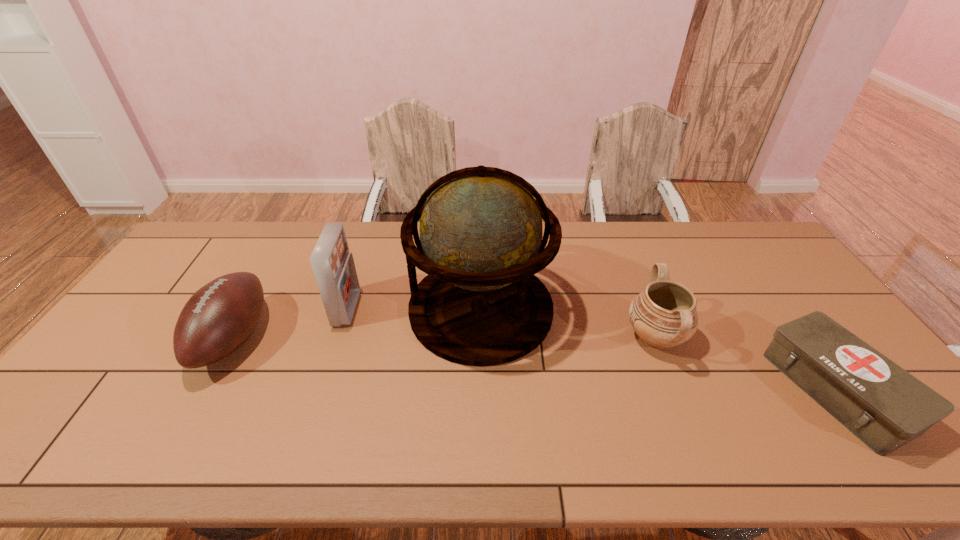
At what (x,y) coordinates should I click in order to perform the action: click on vacant area at the far edge of the desktop. Please return your answer as a coordinate pair (x, y). This screenshot has height=540, width=960. Looking at the image, I should click on coord(259,261).

The height and width of the screenshot is (540, 960). I want to click on vacant region at the left edge of the desktop, so click(137, 373).

In the image, there is a desktop. What are the coordinates of `vacant space at the far left corner` in the screenshot? It's located at (233, 233).

I want to click on free space between the shorter first-aid kit and the urn, so click(x=746, y=363).

Identify the location of free space between the fourth object from right to left and the shorter first-aid kit. pyautogui.click(x=592, y=349).

Locate an element on the screen. This screenshot has height=540, width=960. vacant space that is in between the globe and the right first-aid kit is located at coordinates (659, 350).

Where is `free space between the football (American) and the nearer first-aid kit`? free space between the football (American) and the nearer first-aid kit is located at coordinates (536, 364).

The image size is (960, 540). Identify the location of vacant area that lies between the nearer first-aid kit and the farther first-aid kit. (592, 349).

Image resolution: width=960 pixels, height=540 pixels. Identify the location of unoccupied area between the football (American) and the shorter first-aid kit. (536, 364).

I want to click on empty location between the third object from right to left and the second object from right to left, so click(x=568, y=323).